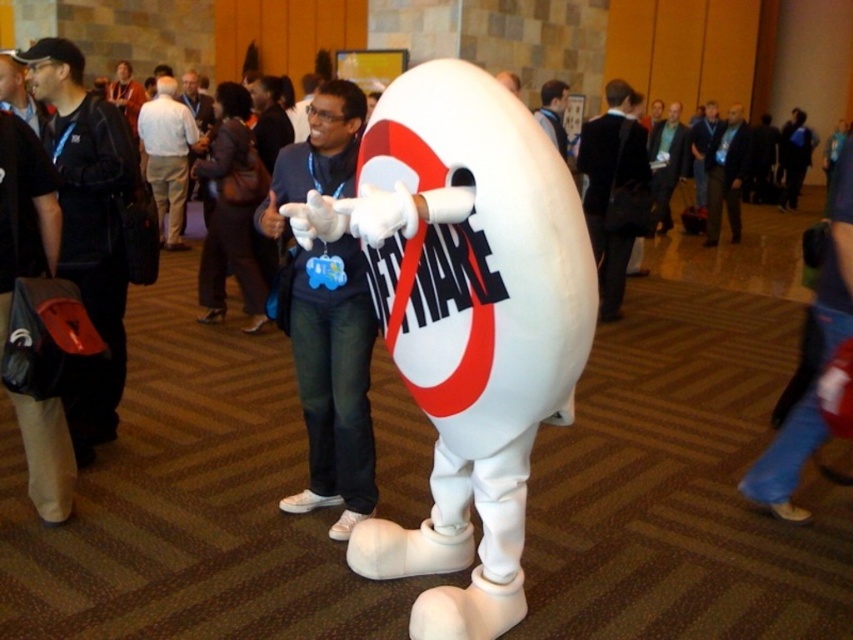
Looking at this image, can you confirm if white foam mascot at center is wider than matte black jacket at upper center?

Yes, white foam mascot at center is wider than matte black jacket at upper center.

Does point (540, 248) come in front of point (540, 99)?

Yes, it is.

Does point (434, 570) lie behind point (554, 112)?

No.

You are a GUI agent. You are given a task and a screenshot of the screen. Output one action in this format:
    pyautogui.click(x=<x>, y=<y>)
    Task: Click on the white foam mascot at center
    The width and height of the screenshot is (853, 640).
    Given the screenshot: What is the action you would take?
    pyautogui.click(x=466, y=321)

Can you confirm if black leather jacket at center is thinner than white cotton shirt at center?

Indeed, black leather jacket at center has a lesser width compared to white cotton shirt at center.

Does black leather jacket at center have a greater width compared to white cotton shirt at center?

No.

Measure the distance between point (612,282) and camera.

Point (612,282) and camera are 5.65 meters apart.

Find the location of `black leather jacket at center`. black leather jacket at center is located at coordinates (614, 192).

At what (x,y) coordinates should I click in order to perform the action: click on black leather jacket at left. Please return your answer as a coordinate pair (x, y). Looking at the image, I should click on (88, 221).

Which is below, black leather jacket at left or matte black jacket at upper center?

Positioned lower is black leather jacket at left.

Who is more distant from viewer, (59,195) or (560,86)?

Point (560,86)

Find the location of a particular element. black leather jacket at left is located at coordinates (88, 221).